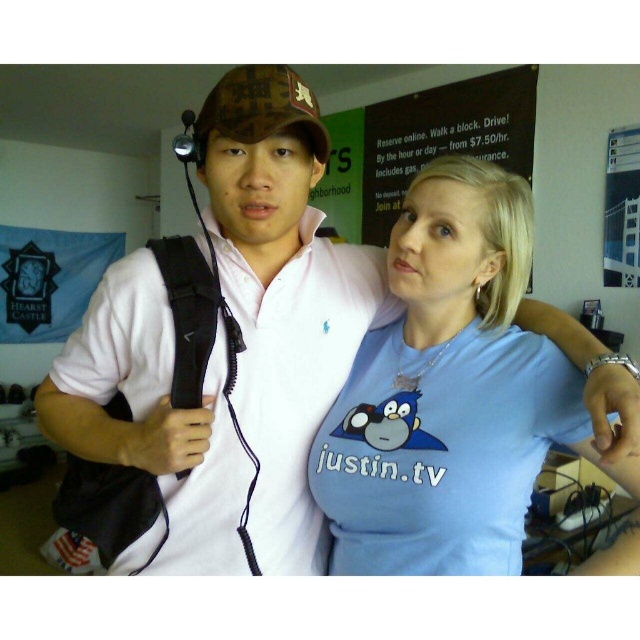
You are standing in the room and want to know which of the two points, point (481,292) or point (323,145), is closer to you. Can you determine this based on their positions?

Point (481,292) is further to the viewer than point (323,145), so the closer point is point (323,145).